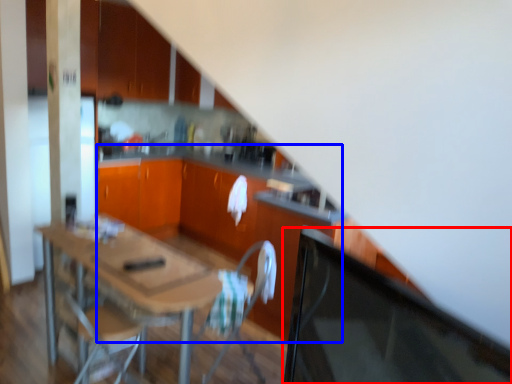
Question: Which object is further to the camera taking this photo, computer monitor (highlighted by a red box) or computer desk (highlighted by a blue box)?

Choices:
 (A) computer monitor
 (B) computer desk

Answer: (B)